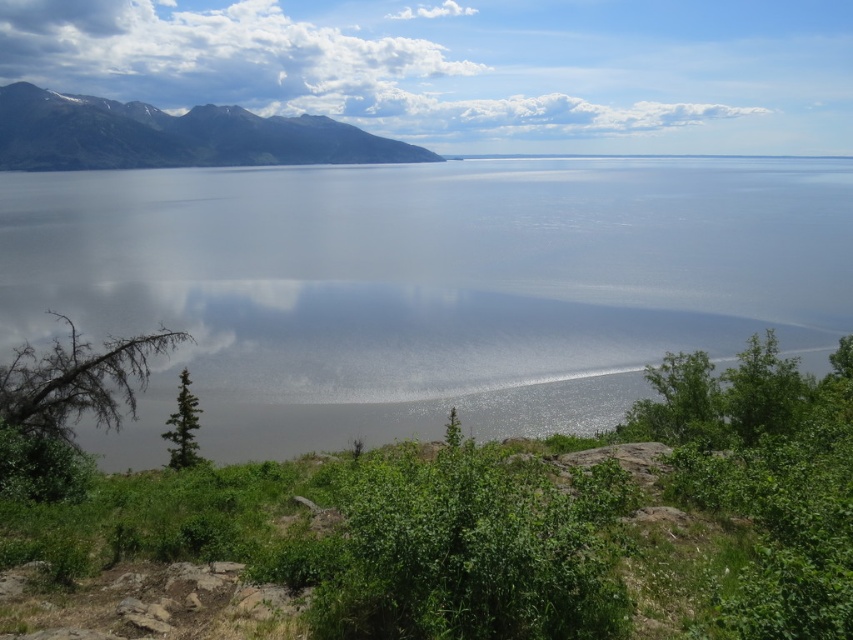
You are an artist trying to paint the clouds in the scene. You want to make sure the sizes of the white fluffy cloud at upper center and the white fluffy cloud at upper left are accurate. Which cloud should you paint larger?

The white fluffy cloud at upper center should be painted larger than the white fluffy cloud at upper left because it is bigger according to the description.

You are an astronomer observing the sky in the image. You notice the white fluffy cloud at upper center. Where exactly is this cloud positioned in the image?

The white fluffy cloud at upper center is located at point 0.106 on the horizontal axis and 0.550 on the vertical axis.